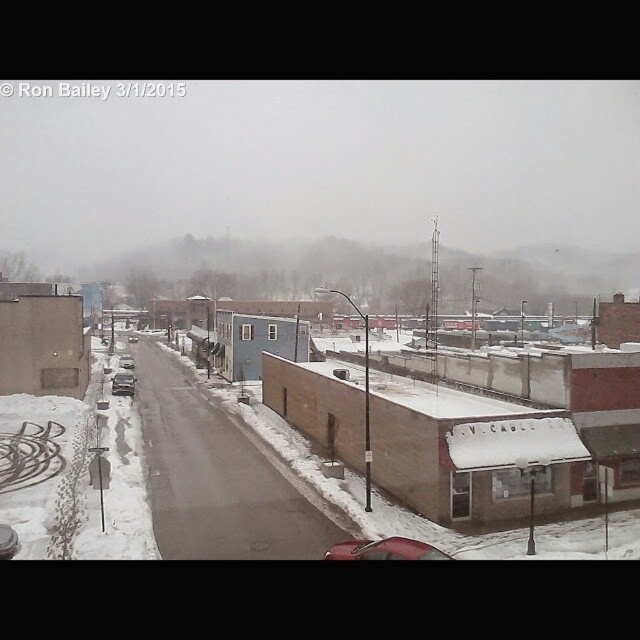
You are standing at the point with coordinates point (134,339) and want to walk to the point with coordinates point (128,362). According to the image, which direction should you face to move towards your destination?

You should face forward because point (128,362) is in front of point (134,339).